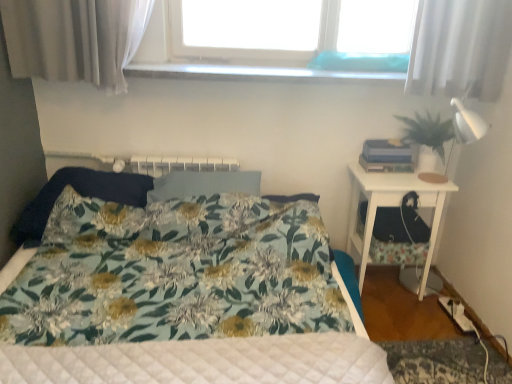
At what (x,y) coordinates should I click in order to perform the action: click on blank space situated above white glossy nightstand at right (from a real-world perspective). Please return your answer as a coordinate pair (x, y). Looking at the image, I should click on (411, 172).